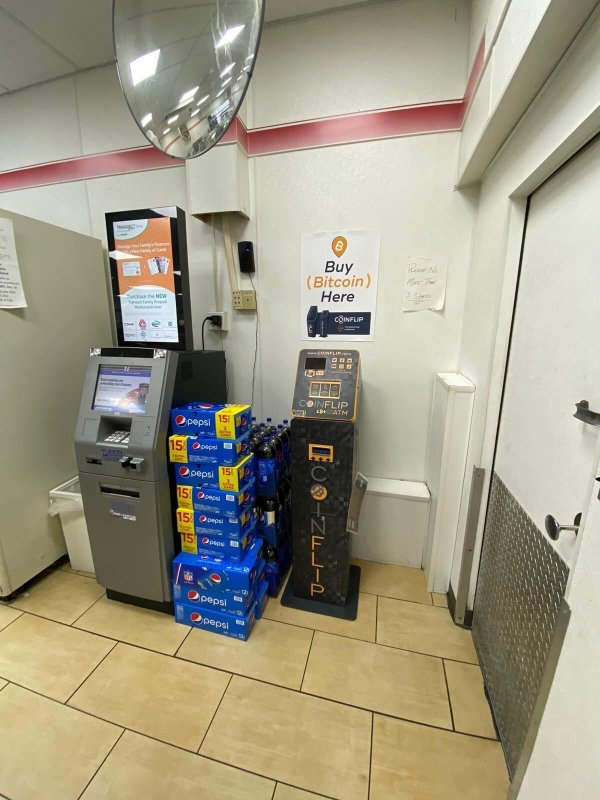
Locate an element on the screen. trash can is located at coordinates (62, 508).